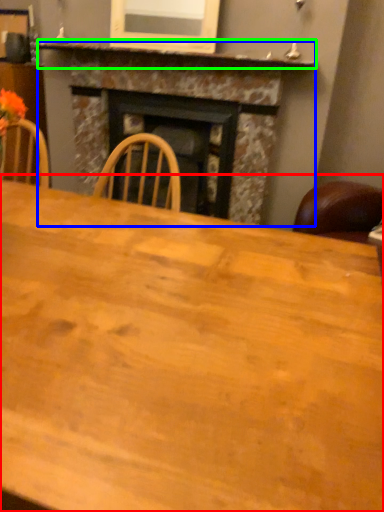
Question: Considering the real-world distances, which object is farthest from table (highlighted by a red box)? fireplace (highlighted by a blue box) or mantle (highlighted by a green box)?

Choices:
 (A) fireplace
 (B) mantle

Answer: (B)